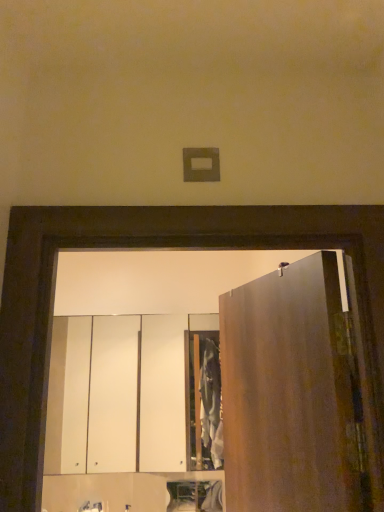
Question: Does matte silver faucet at lower center have a greater width compared to matte brown door at right?

Choices:
 (A) no
 (B) yes

Answer: (B)

Question: Is matte silver faucet at lower center oriented away from matte brown door at right?

Choices:
 (A) yes
 (B) no

Answer: (B)

Question: Is there a large distance between matte silver faucet at lower center and matte brown door at right?

Choices:
 (A) yes
 (B) no

Answer: (A)

Question: Can you confirm if matte silver faucet at lower center is taller than matte brown door at right?

Choices:
 (A) no
 (B) yes

Answer: (A)

Question: Can you confirm if matte silver faucet at lower center is smaller than matte brown door at right?

Choices:
 (A) no
 (B) yes

Answer: (B)

Question: From the image's perspective, relative to white glossy cabinet at lower center, the 2th cabinetry positioned from the top, is white glossy cabinet at center, positioned as the 2th cabinetry in bottom-to-top order, above or below?

Choices:
 (A) above
 (B) below

Answer: (A)

Question: Considering the positions of point (61, 471) and point (52, 510), is point (61, 471) closer or farther from the camera than point (52, 510)?

Choices:
 (A) closer
 (B) farther

Answer: (B)

Question: Choose the correct answer: Is white glossy cabinet at center, arranged as the 1th cabinetry when viewed from the top, inside white glossy cabinet at lower center, the 2th cabinetry positioned from the top, or outside it?

Choices:
 (A) outside
 (B) inside

Answer: (A)

Question: In terms of height, does white glossy cabinet at center, arranged as the 1th cabinetry when viewed from the top, look taller or shorter compared to white glossy cabinet at lower center, the 2th cabinetry positioned from the top?

Choices:
 (A) tall
 (B) short

Answer: (A)

Question: Is matte silver faucet at lower center in front of or behind matte brown door at right in the image?

Choices:
 (A) front
 (B) behind

Answer: (B)

Question: From their relative heights in the image, would you say matte silver faucet at lower center is taller or shorter than matte brown door at right?

Choices:
 (A) tall
 (B) short

Answer: (B)

Question: From the image's perspective, is matte silver faucet at lower center above or below matte brown door at right?

Choices:
 (A) above
 (B) below

Answer: (B)

Question: Do you think matte silver faucet at lower center is within matte brown door at right, or outside of it?

Choices:
 (A) inside
 (B) outside

Answer: (B)

Question: From the image's perspective, is white glossy cabinet at lower center, the 2th cabinetry positioned from the top, positioned above or below white glossy cabinet at center, arranged as the 1th cabinetry when viewed from the top?

Choices:
 (A) above
 (B) below

Answer: (B)

Question: Do you think white glossy cabinet at lower center, the 2th cabinetry positioned from the top, is within white glossy cabinet at center, arranged as the 1th cabinetry when viewed from the top, or outside of it?

Choices:
 (A) inside
 (B) outside

Answer: (B)